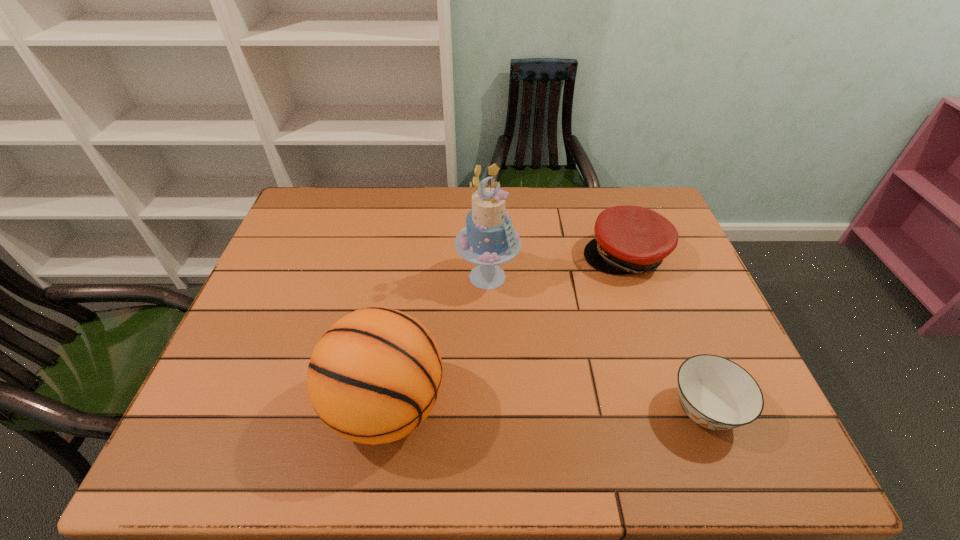
Locate an element on the screen. This screenshot has height=540, width=960. vacant space on the desktop that is between the third shortest object and the shortest object and is positioned with a ladder on the side of the third object from right to left is located at coordinates (590, 409).

You are a GUI agent. You are given a task and a screenshot of the screen. Output one action in this format:
    pyautogui.click(x=<x>, y=<y>)
    Task: Click on the vacant space on the desktop that is between the leftmost object and the soup bowl and is positioned at the front of the third tallest object where the visor is located
    
    Given the screenshot: What is the action you would take?
    pyautogui.click(x=507, y=408)